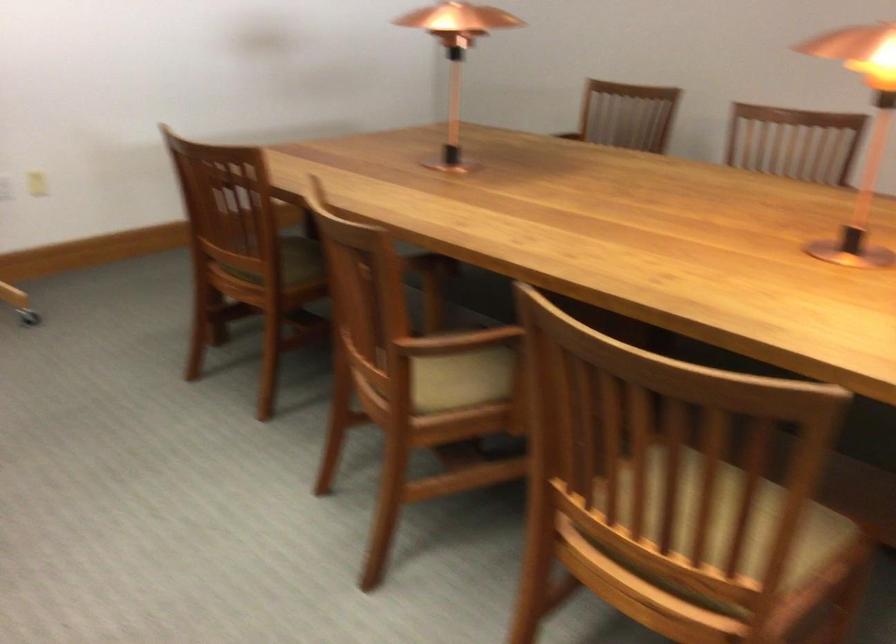
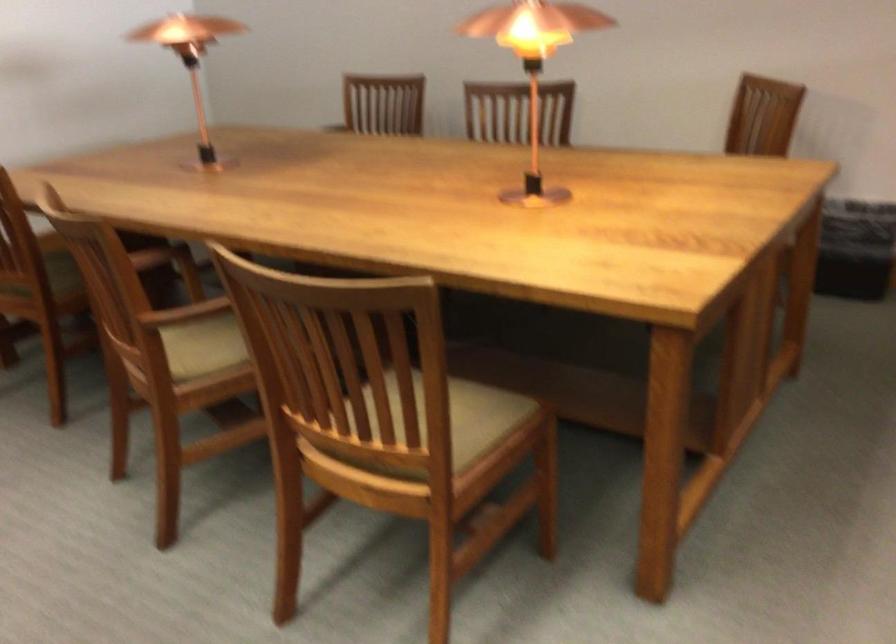
Looking at this image, the images are taken continuously from a first-person perspective. In which direction are you moving?

The movement direction of the cameraman is right, backward.